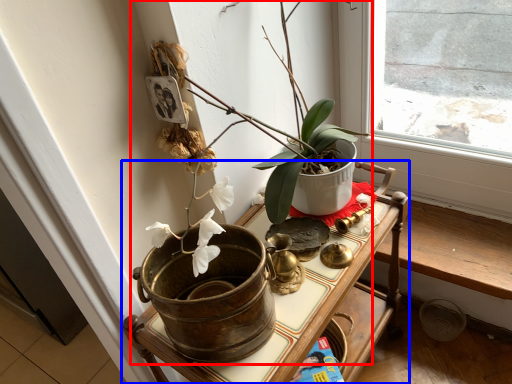
Question: Which object is closer to the camera taking this photo, houseplant (highlighted by a red box) or table (highlighted by a blue box)?

Choices:
 (A) houseplant
 (B) table

Answer: (A)